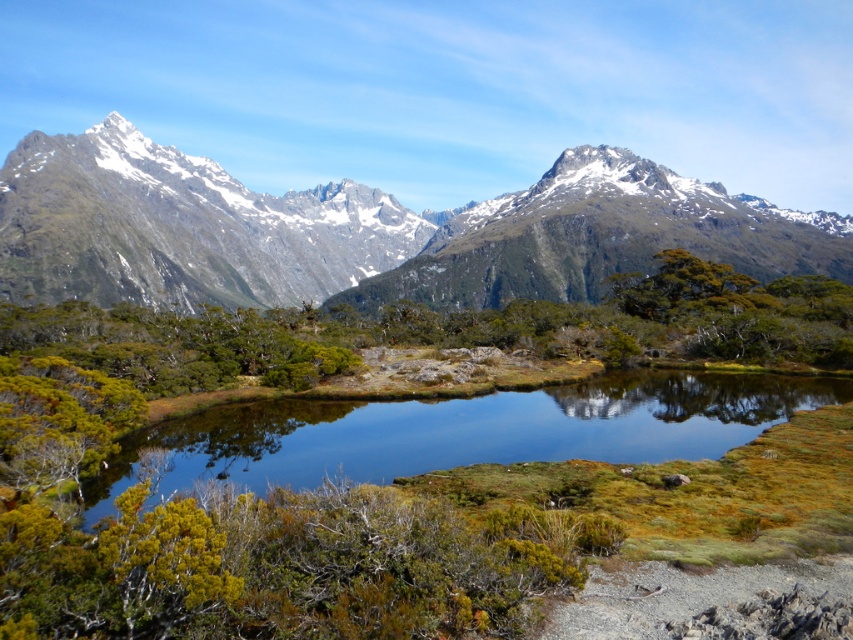
This screenshot has width=853, height=640. Describe the element at coordinates (364, 230) in the screenshot. I see `snowy rock mountain range at upper center` at that location.

Does snowy rock mountain range at upper center appear over green grassy water at center?

Correct, snowy rock mountain range at upper center is located above green grassy water at center.

Is point (450, 269) closer to camera compared to point (548, 403)?

No, (450, 269) is further to viewer.

You are a GUI agent. You are given a task and a screenshot of the screen. Output one action in this format:
    pyautogui.click(x=<x>, y=<y>)
    Task: Click on the snowy rock mountain range at upper center
    
    Given the screenshot: What is the action you would take?
    pyautogui.click(x=364, y=230)